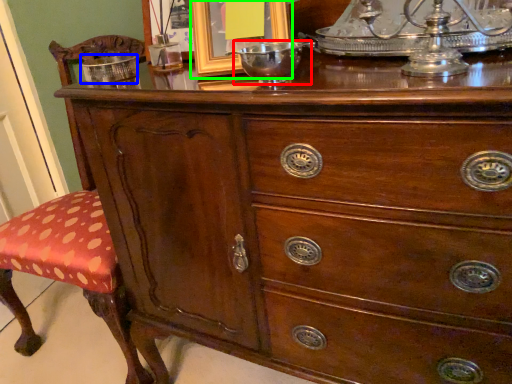
Question: Considering the real-world distances, which object is farthest from glass bowl (highlighted by a red box)? bowl (highlighted by a blue box) or picture frame (highlighted by a green box)?

Choices:
 (A) bowl
 (B) picture frame

Answer: (A)